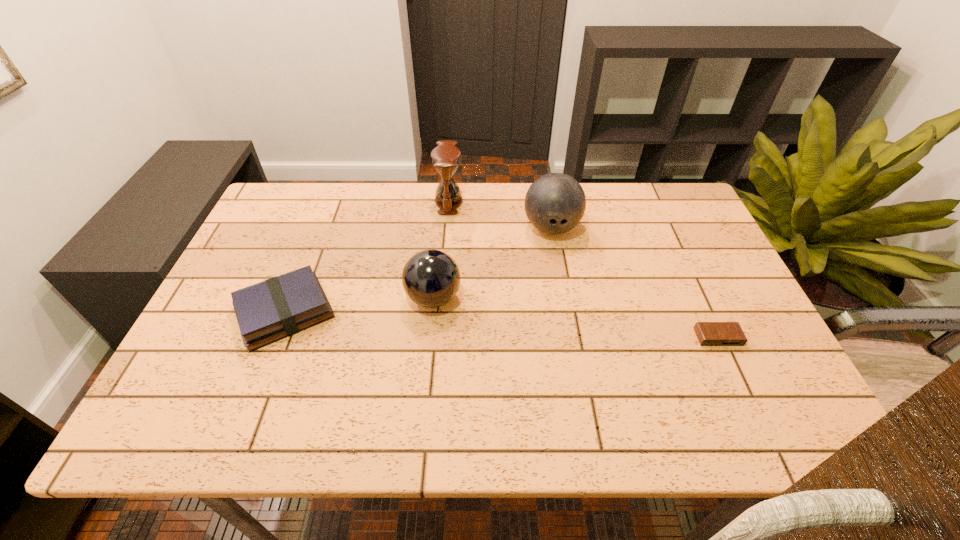
Locate an element on the screen. Image resolution: width=960 pixels, height=540 pixels. vacant space at the left edge is located at coordinates (237, 340).

You are a GUI agent. You are given a task and a screenshot of the screen. Output one action in this format:
    pyautogui.click(x=<x>, y=<y>)
    Task: Click on the vacant area at the right edge of the desktop
    The width and height of the screenshot is (960, 540).
    Given the screenshot: What is the action you would take?
    pyautogui.click(x=726, y=381)

At what (x,y) coordinates should I click in order to perform the action: click on vacant space at the far left corner of the desktop. Please return your answer as a coordinate pair (x, y). The height and width of the screenshot is (540, 960). Looking at the image, I should click on click(283, 194).

The image size is (960, 540). Find the location of `free space at the near left corner`. free space at the near left corner is located at coordinates (226, 432).

Find the location of a particular element. This screenshot has width=960, height=540. blank region between the fourth tallest object and the alarm clock is located at coordinates (501, 325).

In order to click on unoccupied area between the shortest object and the book in this screenshot , I will do point(501,325).

Where is `vacant area between the leftmost object and the hourglass`? This screenshot has width=960, height=540. vacant area between the leftmost object and the hourglass is located at coordinates (367, 257).

Where is `free spot between the shortest object and the left bowling ball`? The height and width of the screenshot is (540, 960). free spot between the shortest object and the left bowling ball is located at coordinates (576, 318).

At what (x,y) coordinates should I click in order to perform the action: click on unoccupied position between the alarm clock and the nearer bowling ball. Please return your answer as a coordinate pair (x, y). This screenshot has width=960, height=540. Looking at the image, I should click on (576, 318).

Where is `free space between the hourglass and the second shortest object`? free space between the hourglass and the second shortest object is located at coordinates (367, 257).